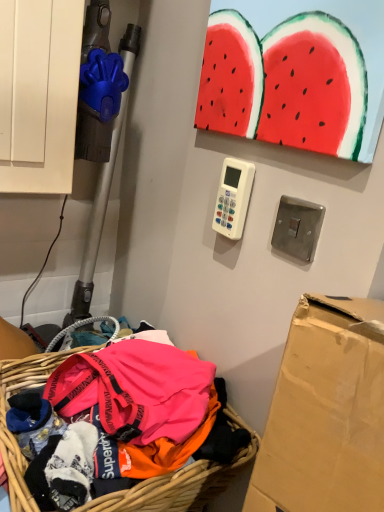
Question: Considering the relative sizes of bright pink fabric at lower left and brushed metal light switch at upper right in the image provided, is bright pink fabric at lower left smaller than brushed metal light switch at upper right?

Choices:
 (A) no
 (B) yes

Answer: (A)

Question: Is bright pink fabric at lower left to the right of brushed metal light switch at upper right from the viewer's perspective?

Choices:
 (A) yes
 (B) no

Answer: (B)

Question: Does bright pink fabric at lower left come in front of brushed metal light switch at upper right?

Choices:
 (A) yes
 (B) no

Answer: (A)

Question: Is bright pink fabric at lower left at the left side of brushed metal light switch at upper right?

Choices:
 (A) yes
 (B) no

Answer: (A)

Question: Is bright pink fabric at lower left thinner than brushed metal light switch at upper right?

Choices:
 (A) no
 (B) yes

Answer: (A)

Question: From the image's perspective, is brushed metal light switch at upper right positioned above or below white plastic remote control at center?

Choices:
 (A) above
 (B) below

Answer: (B)

Question: From their relative heights in the image, would you say brushed metal light switch at upper right is taller or shorter than white plastic remote control at center?

Choices:
 (A) tall
 (B) short

Answer: (B)

Question: Is point (294, 225) closer or farther from the camera than point (248, 194)?

Choices:
 (A) farther
 (B) closer

Answer: (A)

Question: From a real-world perspective, relative to white plastic remote control at center, is brushed metal light switch at upper right vertically above or below?

Choices:
 (A) below
 (B) above

Answer: (A)

Question: In terms of height, does brushed metal light switch at upper right look taller or shorter compared to bright pink fabric at lower left?

Choices:
 (A) short
 (B) tall

Answer: (A)

Question: From the image's perspective, is brushed metal light switch at upper right located above or below bright pink fabric at lower left?

Choices:
 (A) above
 (B) below

Answer: (A)

Question: Is point (322, 206) positioned closer to the camera than point (173, 473)?

Choices:
 (A) closer
 (B) farther

Answer: (A)

Question: Is brushed metal light switch at upper right inside the boundaries of bright pink fabric at lower left, or outside?

Choices:
 (A) outside
 (B) inside

Answer: (A)

Question: Choose the correct answer: Is white plastic remote control at center inside bright pink fabric at lower left or outside it?

Choices:
 (A) inside
 (B) outside

Answer: (B)

Question: From a real-world perspective, is white plastic remote control at center above or below bright pink fabric at lower left?

Choices:
 (A) above
 (B) below

Answer: (A)